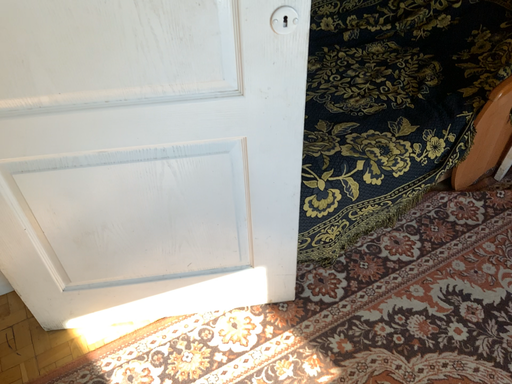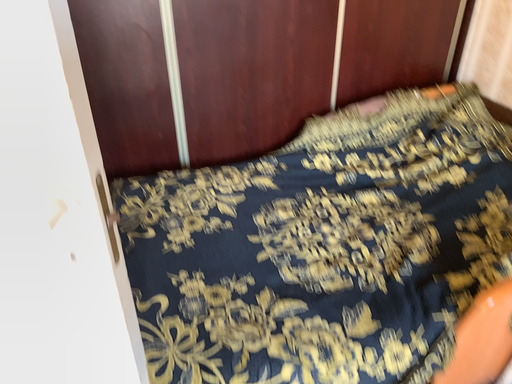
Question: Which way did the camera rotate in the video?

Choices:
 (A) rotated right
 (B) rotated left

Answer: (B)